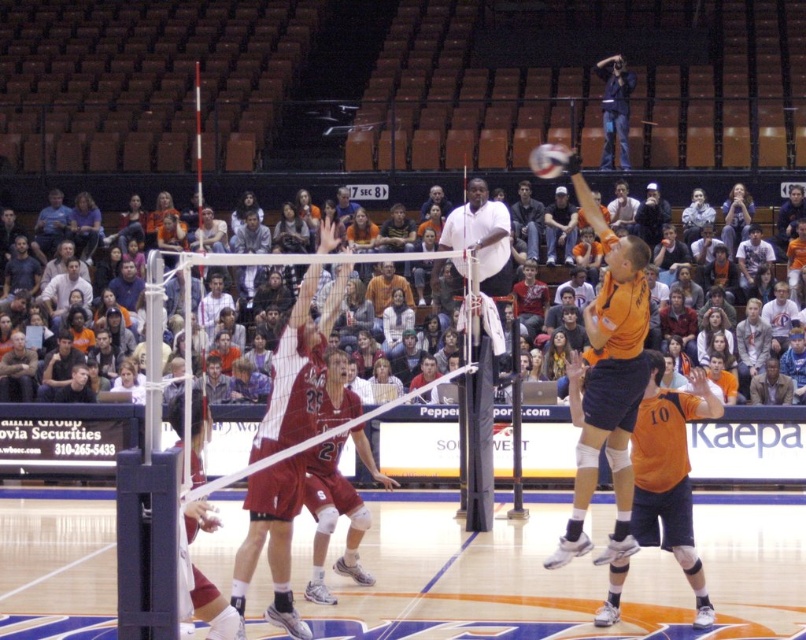
You are a photographer positioned at the camera location. You want to capture a closeup shot of the volleyball. The volleyball is located at point [64,184]. If your camera can focus on objects within 20 meters, will you be able to focus on the volleyball?

The volleyball located at point [64,184] is 23.97 meters away from the camera. Since the camera can only focus within 20 meters, it will not be able to focus on the volleyball.

You are a referee observing the volleyball match. You need to determine if the ball is in a legal position for a spike. According to the rules, the ball must be above the net when spiked. Can you confirm if the white matte volleyball at center is positioned above the net relative to the orange uniformed player at center?

The white matte volleyball at center is behind the orange uniformed player at center, so it is not positioned above the net. Therefore, the spike would be considered illegal.

You are a coach analyzing the volleyball game. The court has a center line at coordinates 0.5, 0.5. Where is the orange uniformed player at center located in relation to the court center?

The orange uniformed player at center is located to the right and above the court center, as their coordinates are at (559, 577), which is to the right and above the center point of (403, 320).